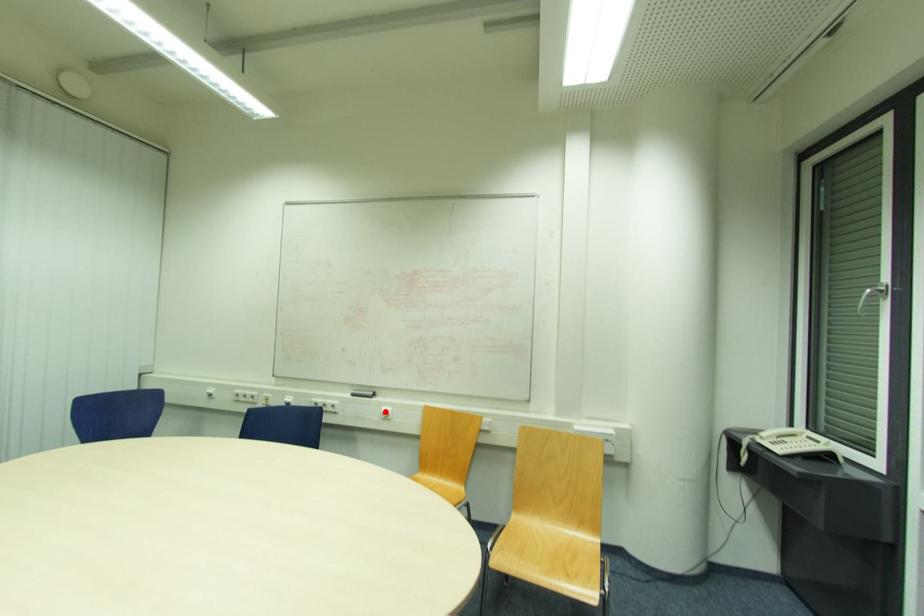
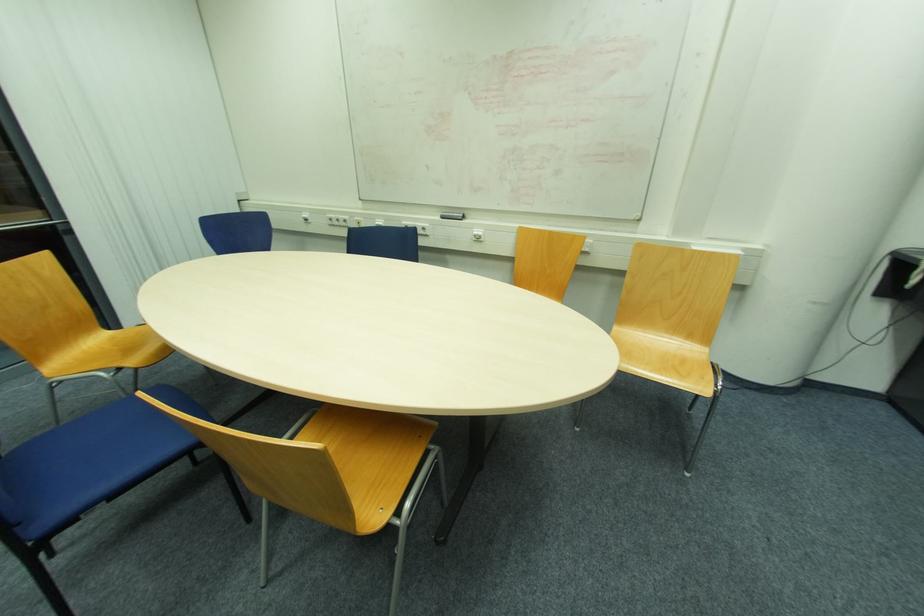
Where in the second image is the point corresponding to the highlighted location from the first image?

(477, 233)